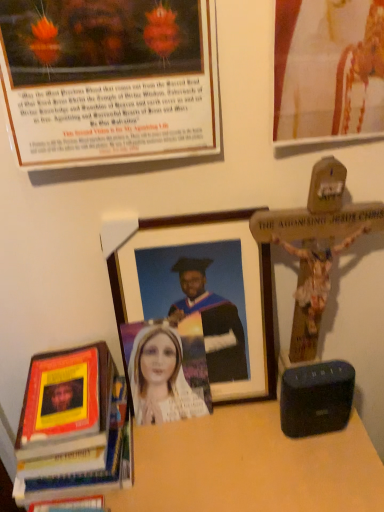
Where is `free space between black plastic speaker at lower right and wooden picture frame at center, acting as the 1th picture frame starting from the bottom`? free space between black plastic speaker at lower right and wooden picture frame at center, acting as the 1th picture frame starting from the bottom is located at coordinates (226, 436).